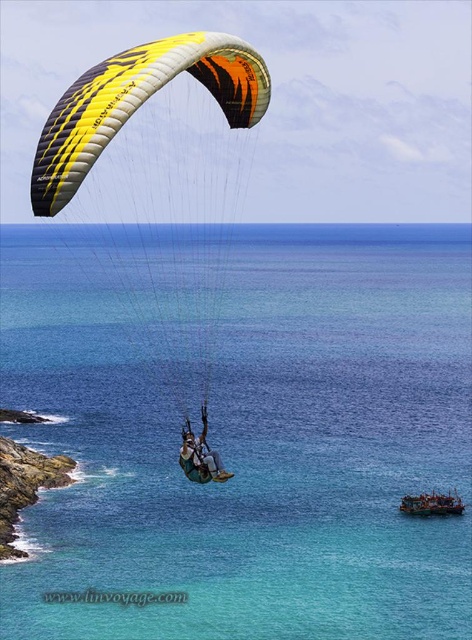
Question: Among these objects, which one is farthest from the camera?

Choices:
 (A) yellow/orange fabric parachute at upper center
 (B) rocky cliff at lower left
 (C) matte yellow parachute at upper center

Answer: (B)

Question: Can you confirm if yellow/orange fabric parachute at upper center is positioned below matte yellow parachute at upper center?

Choices:
 (A) yes
 (B) no

Answer: (B)

Question: Which object is the closest to the yellow/orange fabric parachute at upper center?

Choices:
 (A) transparent blue water at center
 (B) matte yellow parachute at upper center

Answer: (A)

Question: Is yellow/orange fabric parachute at upper center above matte yellow parachute at upper center?

Choices:
 (A) no
 (B) yes

Answer: (B)

Question: Which of the following is the farthest from the observer?

Choices:
 (A) (14, 492)
 (B) (210, 449)
 (C) (129, 112)
 (D) (291, 458)

Answer: (D)

Question: Does transparent blue water at center have a larger size compared to rocky cliff at lower left?

Choices:
 (A) no
 (B) yes

Answer: (B)